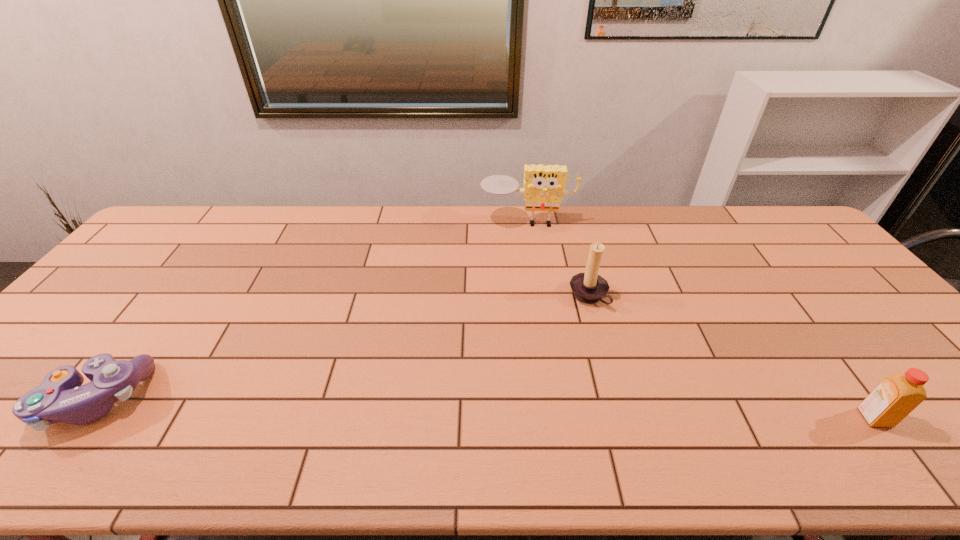
Image resolution: width=960 pixels, height=540 pixels. In order to click on free location at the near edge of the desktop in this screenshot , I will do `click(294, 397)`.

The width and height of the screenshot is (960, 540). Find the location of `free space between the candle holder and the sponge`. free space between the candle holder and the sponge is located at coordinates (558, 259).

Where is `vacant space that is in between the second shortest object and the sponge`? The width and height of the screenshot is (960, 540). vacant space that is in between the second shortest object and the sponge is located at coordinates (701, 320).

Find the location of a particular element. Image resolution: width=960 pixels, height=540 pixels. vacant area between the leftmost object and the candle holder is located at coordinates (342, 347).

You are a GUI agent. You are given a task and a screenshot of the screen. Output one action in this format:
    pyautogui.click(x=<x>, y=<y>)
    Task: Click on the vacant area between the farthest object and the shortest object
    The height and width of the screenshot is (540, 960).
    Given the screenshot: What is the action you would take?
    pyautogui.click(x=311, y=310)

The image size is (960, 540). Identify the location of vacant region between the sponge and the second farthest object. (558, 259).

Identify the location of unoccupied area between the leftmost object and the farthest object. The width and height of the screenshot is (960, 540). (311, 310).

Locate an element on the screen. The height and width of the screenshot is (540, 960). vacant area between the candle holder and the control is located at coordinates (342, 347).

Find the location of a particular element. The image size is (960, 540). unoccupied area between the second shortest object and the third nearest object is located at coordinates (732, 357).

Image resolution: width=960 pixels, height=540 pixels. In order to click on empty space between the leftmost object and the candle holder in this screenshot , I will do `click(342, 347)`.